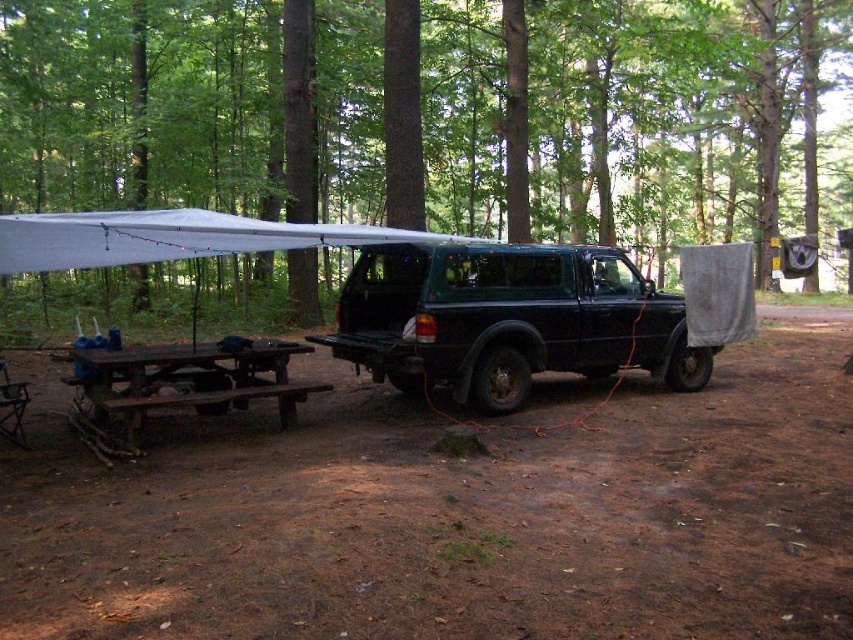
Question: Does green matte tree at center have a lesser width compared to black matte jeep at center?

Choices:
 (A) no
 (B) yes

Answer: (A)

Question: Is black matte jeep at center in front of brown wooden picnic table at lower left?

Choices:
 (A) no
 (B) yes

Answer: (A)

Question: In this image, where is green matte tree at center located relative to black matte jeep at center?

Choices:
 (A) right
 (B) left

Answer: (A)

Question: Which of the following is the closest to the observer?

Choices:
 (A) pyautogui.click(x=602, y=346)
 (B) pyautogui.click(x=82, y=397)

Answer: (B)

Question: Among these objects, which one is nearest to the camera?

Choices:
 (A) green matte tree at center
 (B) brown wooden picnic table at lower left
 (C) black matte jeep at center

Answer: (B)

Question: Among these objects, which one is farthest from the camera?

Choices:
 (A) brown wooden picnic table at lower left
 (B) black matte jeep at center

Answer: (B)